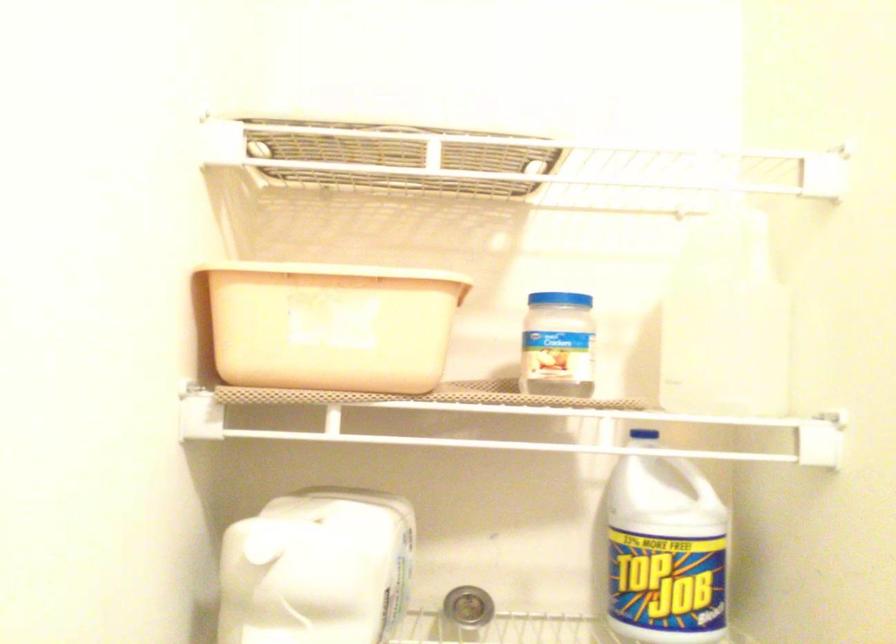
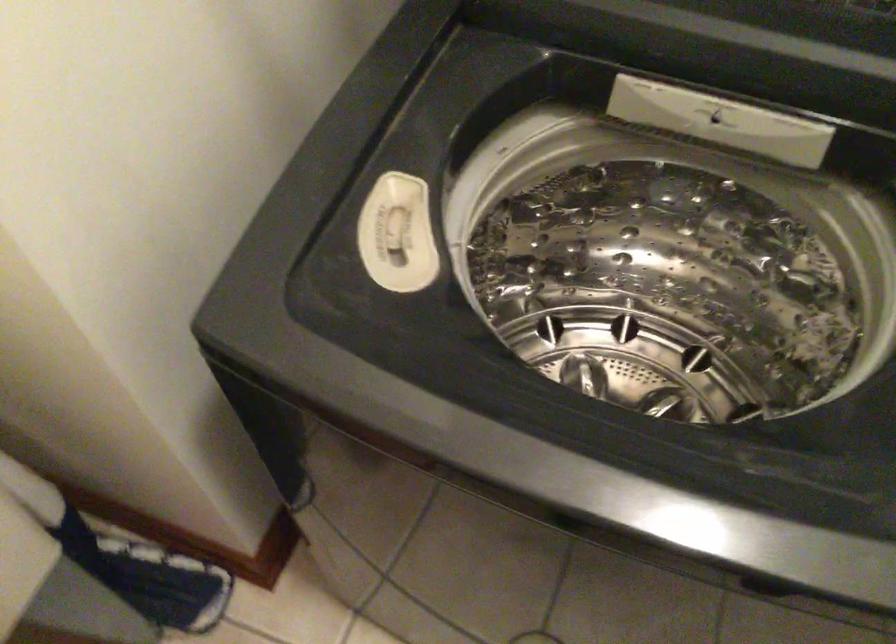
First-person continuous shooting, in which direction is the camera rotating?

The camera's rotation is toward right-down.